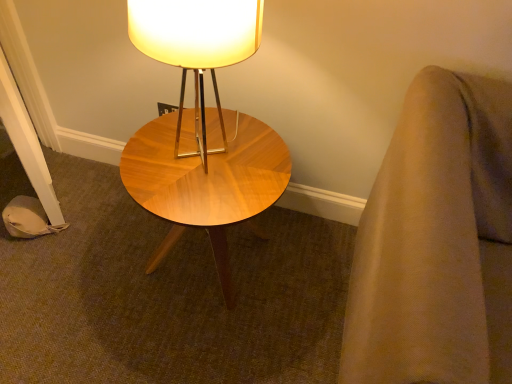
The width and height of the screenshot is (512, 384). What are the coordinates of `empty space that is ontop of woodenwoodencoffee table at center (from a real-world perspective)` in the screenshot? It's located at (204, 152).